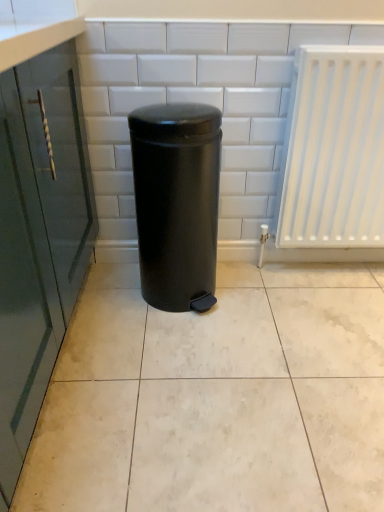
Locate an element on the screen. The width and height of the screenshot is (384, 512). blank area beneath white plastic radiator at right (from a real-world perspective) is located at coordinates (350, 264).